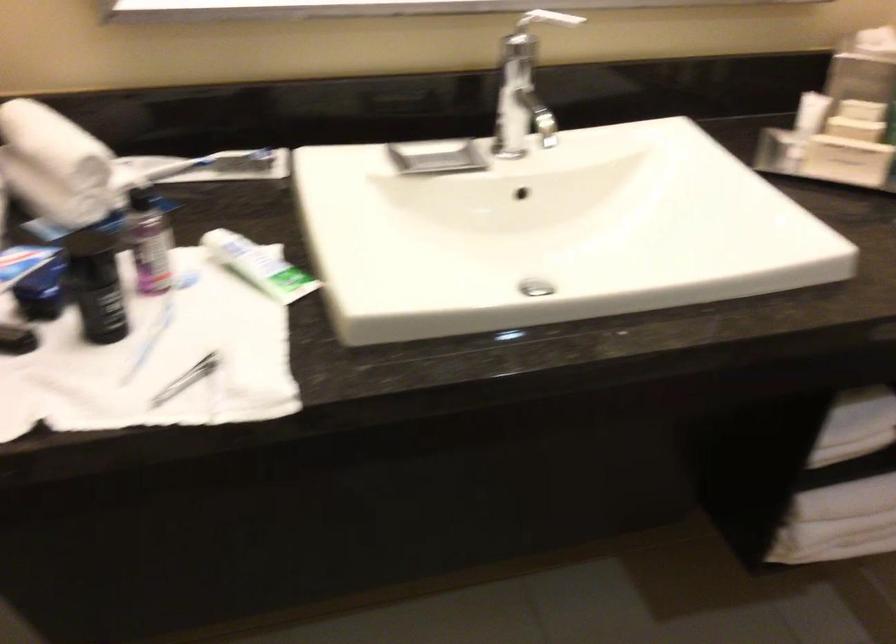
Identify the location of faucet lever handle. The width and height of the screenshot is (896, 644). (533, 11).